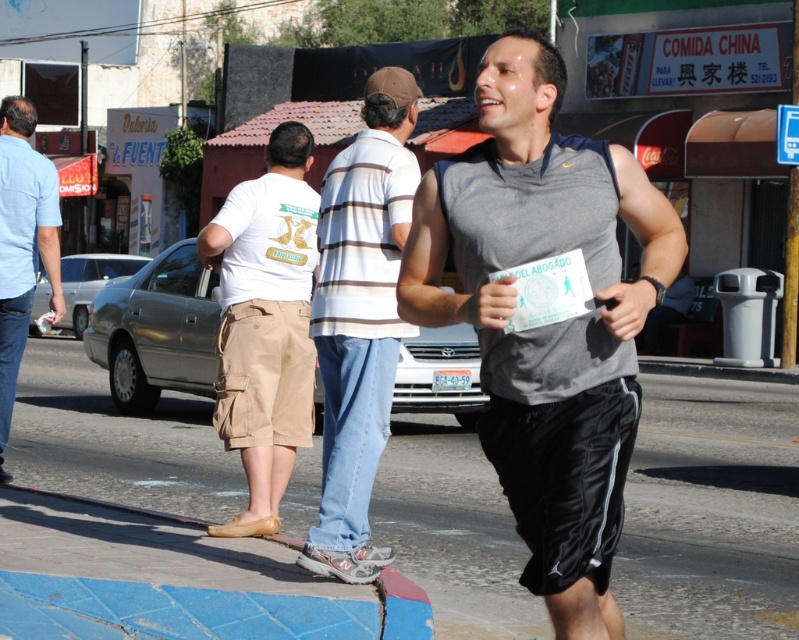
Is striped cotton shirt at center to the left of tan cargo shorts at center from the viewer's perspective?

Incorrect, striped cotton shirt at center is not on the left side of tan cargo shorts at center.

Can you confirm if striped cotton shirt at center is taller than tan cargo shorts at center?

No.

Describe the element at coordinates (360, 320) in the screenshot. I see `striped cotton shirt at center` at that location.

At what (x,y) coordinates should I click in order to perform the action: click on striped cotton shirt at center. Please return your answer as a coordinate pair (x, y). Looking at the image, I should click on (360, 320).

Is tan cargo shorts at center to the right of blue denim jeans at left from the viewer's perspective?

Correct, you'll find tan cargo shorts at center to the right of blue denim jeans at left.

Based on the photo, which is more to the left, tan cargo shorts at center or blue denim jeans at left?

Positioned to the left is blue denim jeans at left.

This screenshot has width=799, height=640. What do you see at coordinates (265, 323) in the screenshot?
I see `tan cargo shorts at center` at bounding box center [265, 323].

Locate an element on the screen. tan cargo shorts at center is located at coordinates (265, 323).

Is blue concrete sidewalk at lower center to the right of gray fabric tank top at center from the viewer's perspective?

Incorrect, blue concrete sidewalk at lower center is not on the right side of gray fabric tank top at center.

Is point (487, 573) farther from viewer compared to point (618, 486)?

Yes, point (487, 573) is behind point (618, 486).

Where is `blue concrete sidewalk at lower center`? This screenshot has height=640, width=799. blue concrete sidewalk at lower center is located at coordinates (710, 512).